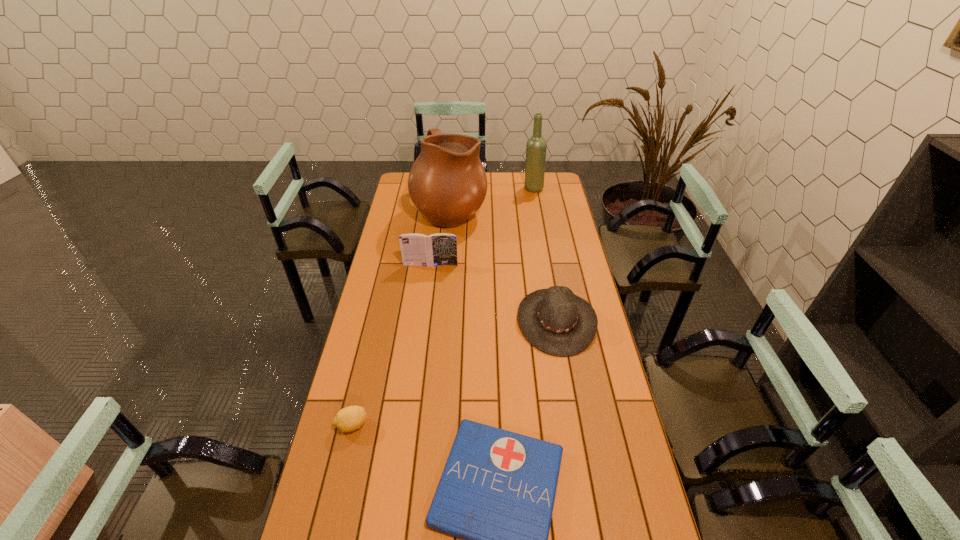
I want to click on cream pitcher, so click(447, 183).

I want to click on wine bottle, so click(536, 146).

The width and height of the screenshot is (960, 540). In order to click on the third farthest object in this screenshot , I will do `click(437, 249)`.

Where is `book`? The width and height of the screenshot is (960, 540). book is located at coordinates (437, 249).

This screenshot has height=540, width=960. What are the coordinates of `the fourth tallest object` in the screenshot? It's located at (555, 321).

The width and height of the screenshot is (960, 540). What are the coordinates of `hat` in the screenshot? It's located at (555, 321).

Where is `lemon`? The image size is (960, 540). lemon is located at coordinates (348, 419).

The image size is (960, 540). Identify the location of the second shortest object. (348, 419).

Identify the location of free location located 0.310m at the spout of the cream pitcher. (548, 210).

Identify the location of free space located on the left of the wine bottle. The width and height of the screenshot is (960, 540). (499, 188).